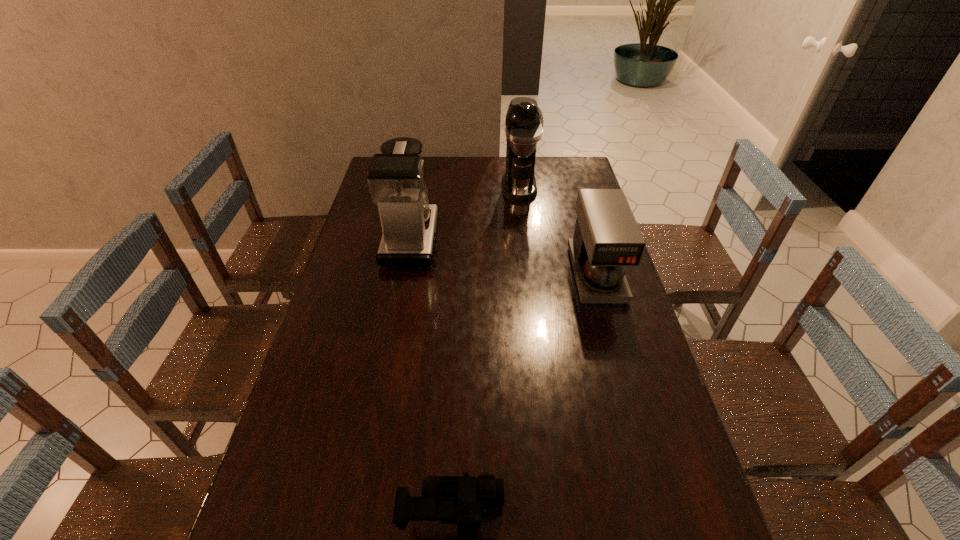
Identify which object is located as the second nearest to the second coffee maker from right to left. Please provide its 2D coordinates. Your answer should be formatted as a tuple, i.e. [(x, y)], where the tuple contains the x and y coordinates of a point satisfying the conditions above.

[(607, 238)]

Identify which object is the closest to the shortest coffee maker. Please provide its 2D coordinates. Your answer should be formatted as a tuple, i.e. [(x, y)], where the tuple contains the x and y coordinates of a point satisfying the conditions above.

[(524, 120)]

Select which coffee maker is the second closest to the third tallest object. Please provide its 2D coordinates. Your answer should be formatted as a tuple, i.e. [(x, y)], where the tuple contains the x and y coordinates of a point satisfying the conditions above.

[(395, 178)]

The width and height of the screenshot is (960, 540). Find the location of `coffee maker that stands as the closest to the second shortest object`. coffee maker that stands as the closest to the second shortest object is located at coordinates (524, 120).

Identify the location of free space that satisfies the following two spatial constraints: 1. place cup under the spout of the farthest coffee maker; 2. at the front of the leftmost coffee maker where the controls are located. The image size is (960, 540). tap(526, 239).

This screenshot has width=960, height=540. In order to click on free space that satisfies the following two spatial constraints: 1. place cup under the spout of the farthest object; 2. at the front of the leftmost coffee maker where the controls are located in this screenshot , I will do `click(526, 239)`.

Image resolution: width=960 pixels, height=540 pixels. What are the coordinates of `free space that satisfies the following two spatial constraints: 1. place cup under the spout of the second coffee maker from left to right; 2. at the front of the leftmost coffee maker where the controls are located` in the screenshot? It's located at (526, 239).